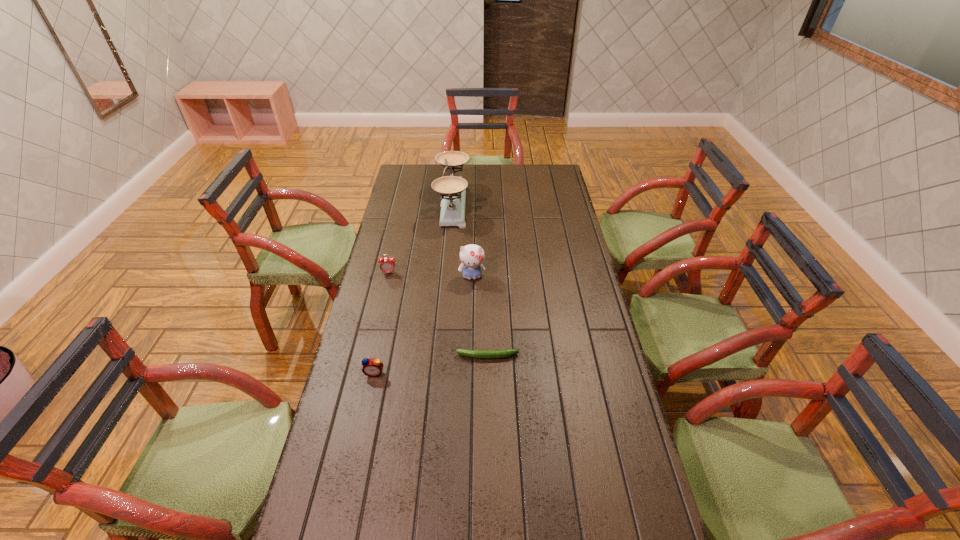
Identify the location of scale. pos(452,189).

Identify the location of the farthest object. This screenshot has height=540, width=960. (452, 189).

Locate an element on the screen. the fourth shortest object is located at coordinates (471, 256).

At what (x,y) coordinates should I click in order to perform the action: click on the farther alarm clock. Please return your answer as a coordinate pair (x, y). This screenshot has height=540, width=960. Looking at the image, I should click on (387, 265).

You are a GUI agent. You are given a task and a screenshot of the screen. Output one action in this format:
    pyautogui.click(x=<x>, y=<y>)
    Task: Click on the nearer alarm clock
    
    Given the screenshot: What is the action you would take?
    pyautogui.click(x=372, y=367)

The height and width of the screenshot is (540, 960). I want to click on the second nearest object, so coord(482,354).

Identify the location of zucchini. (482, 354).

Locate an element on the screen. vacant region located on the front-facing side of the scale is located at coordinates (553, 205).

Where is `vacant region located on the front-facing side of the fourth shortest object`? vacant region located on the front-facing side of the fourth shortest object is located at coordinates (469, 372).

Find the location of a particular element. The height and width of the screenshot is (540, 960). free space located 0.110m on the face of the farther alarm clock is located at coordinates (384, 295).